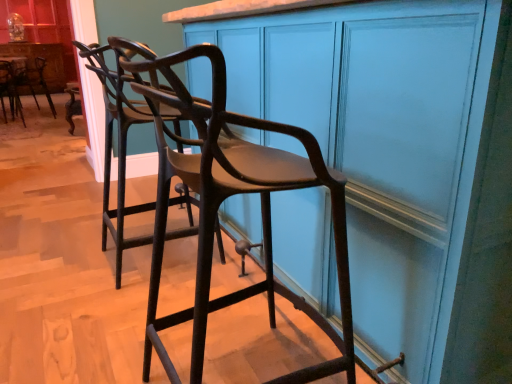
Question: Would you say matte wood cabinet at center, placed as the 2th cabinetry when sorted from top to bottom, is part of matte brown wood chair at center, which ranks as the 3th chair in left-to-right order,'s contents?

Choices:
 (A) yes
 (B) no

Answer: (B)

Question: Does matte brown wood chair at center, the 1th chair from the front, have a lesser height compared to matte wood cabinet at center, which is the 1th cabinetry in front-to-back order?

Choices:
 (A) yes
 (B) no

Answer: (A)

Question: Is matte brown wood chair at center, the 1th chair from the front, at the left side of matte wood cabinet at center, the second cabinetry when ordered from back to front?

Choices:
 (A) yes
 (B) no

Answer: (A)

Question: From the image's perspective, is matte brown wood chair at center, which ranks as the 3th chair in left-to-right order, on matte wood cabinet at center, which is the 1th cabinetry in front-to-back order?

Choices:
 (A) no
 (B) yes

Answer: (A)

Question: Is matte brown wood chair at center, marked as the first chair in a bottom-to-top arrangement, not within matte wood cabinet at center, the second cabinetry when ordered from back to front?

Choices:
 (A) no
 (B) yes

Answer: (B)

Question: Relative to matte blue cabinet at upper left, the first cabinetry when ordered from left to right, is matte black bar stool at left, which appears as the 2th chair when ordered from the bottom, in front or behind?

Choices:
 (A) behind
 (B) front

Answer: (B)

Question: In terms of width, does matte black bar stool at left, which appears as the 2th chair when ordered from the bottom, look wider or thinner when compared to matte blue cabinet at upper left, marked as the 2th cabinetry in a bottom-to-top arrangement?

Choices:
 (A) thin
 (B) wide

Answer: (B)

Question: Do you think matte black bar stool at left, which appears as the 2th chair when ordered from the bottom, is within matte blue cabinet at upper left, the first cabinetry when ordered from left to right, or outside of it?

Choices:
 (A) inside
 (B) outside

Answer: (B)

Question: Considering the positions of matte black bar stool at left, acting as the 2th chair starting from the right, and matte blue cabinet at upper left, marked as the 2th cabinetry in a bottom-to-top arrangement, in the image, is matte black bar stool at left, acting as the 2th chair starting from the right, taller or shorter than matte blue cabinet at upper left, marked as the 2th cabinetry in a bottom-to-top arrangement,?

Choices:
 (A) short
 (B) tall

Answer: (A)

Question: From the image's perspective, relative to matte brown wood chair at center, the 3th chair when ordered from back to front, is matte wood cabinet at center, the second cabinetry from the left, above or below?

Choices:
 (A) below
 (B) above

Answer: (B)

Question: Looking at their shapes, would you say matte wood cabinet at center, the second cabinetry from the left, is wider or thinner than matte brown wood chair at center, which appears as the 1th chair when viewed from the right?

Choices:
 (A) wide
 (B) thin

Answer: (A)

Question: Is matte wood cabinet at center, acting as the 1th cabinetry starting from the bottom, bigger or smaller than matte brown wood chair at center, the 1th chair from the front?

Choices:
 (A) small
 (B) big

Answer: (B)

Question: Is matte wood cabinet at center, the second cabinetry from the left, to the left or to the right of matte brown wood chair at center, which ranks as the 3th chair in left-to-right order, in the image?

Choices:
 (A) right
 (B) left

Answer: (A)

Question: In terms of height, does matte black bar stool at left, which ranks as the 3th chair in front-to-back order, look taller or shorter compared to matte brown wood chair at center, the 3th chair when ordered from back to front?

Choices:
 (A) short
 (B) tall

Answer: (A)

Question: Is matte black bar stool at left, the 1th chair when ordered from left to right, spatially inside matte brown wood chair at center, which ranks as the 3th chair in left-to-right order, or outside of it?

Choices:
 (A) inside
 (B) outside

Answer: (B)